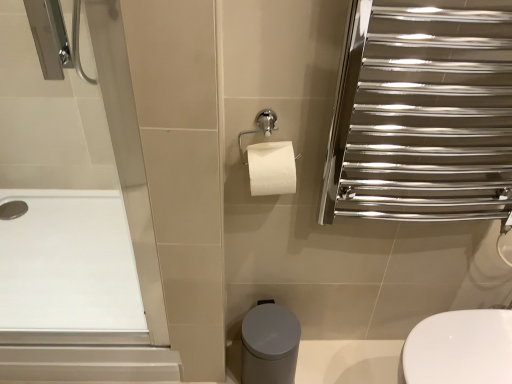
Question: From their relative heights in the image, would you say white glossy toilet at lower right is taller or shorter than polished chrome towel rack at upper right?

Choices:
 (A) short
 (B) tall

Answer: (A)

Question: In terms of width, does white glossy toilet at lower right look wider or thinner when compared to polished chrome towel rack at upper right?

Choices:
 (A) wide
 (B) thin

Answer: (A)

Question: Which of these objects is positioned closest to the white smooth bath at left?

Choices:
 (A) white glossy toilet at lower right
 (B) polished chrome towel rack at upper right
 (C) matte gray bidet at lower center

Answer: (C)

Question: Estimate the real-world distances between objects in this image. Which object is closer to the polished chrome towel rack at upper right?

Choices:
 (A) matte gray bidet at lower center
 (B) white glossy toilet at lower right
 (C) white smooth bath at left

Answer: (B)